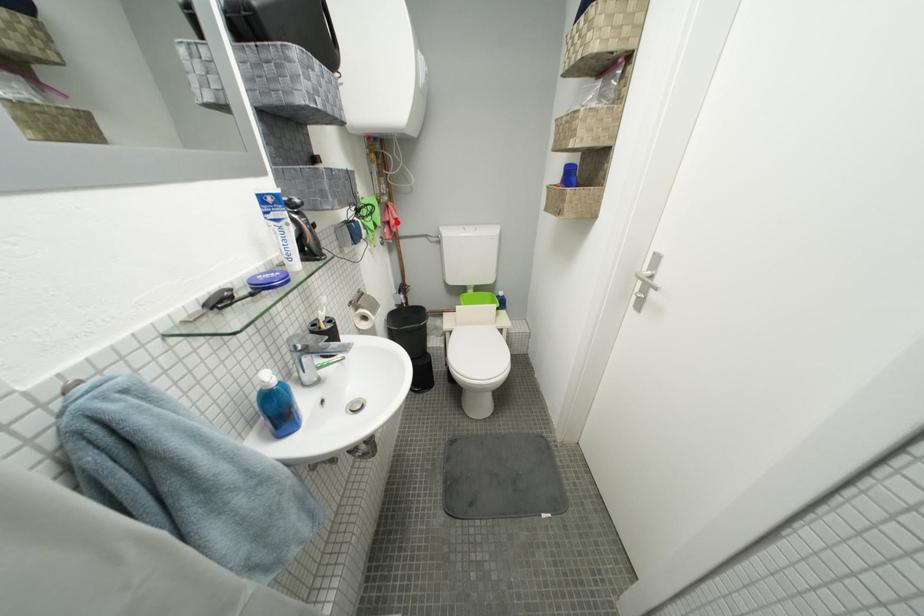
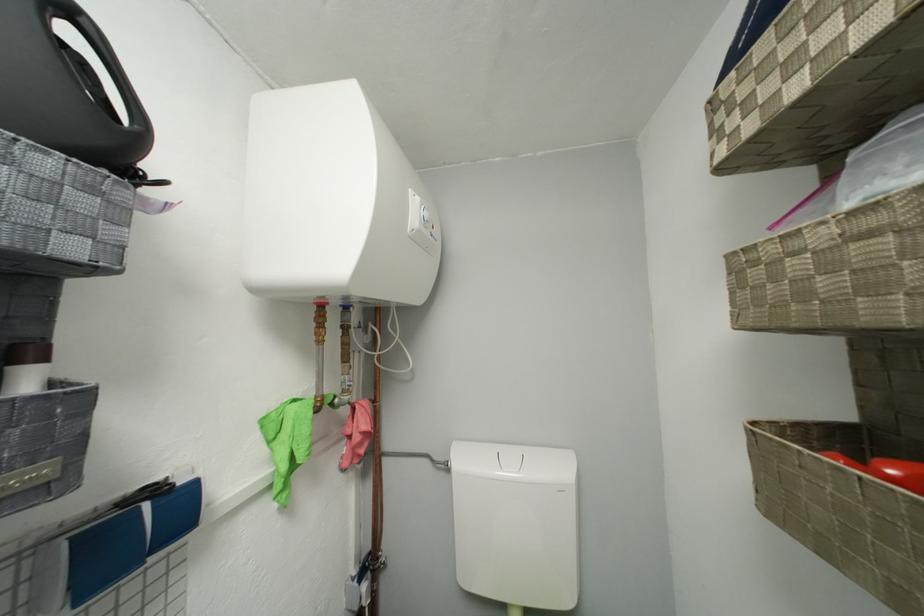
Question: A red point is marked in image1. In image2, is the corresponding 3D point closer to the camera or farther? Reply with the corresponding letter.

Choices:
 (A) The corresponding 3D point is closer.
 (B) The corresponding 3D point is farther.

Answer: (B)